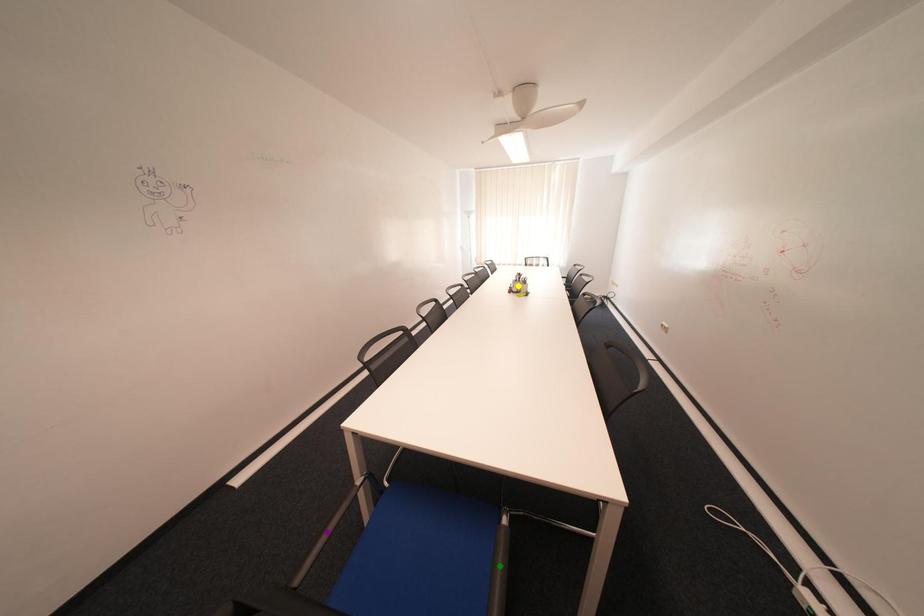
Order these from nearest to farthest:
- green point
- purple point
- yellow point

green point < purple point < yellow point